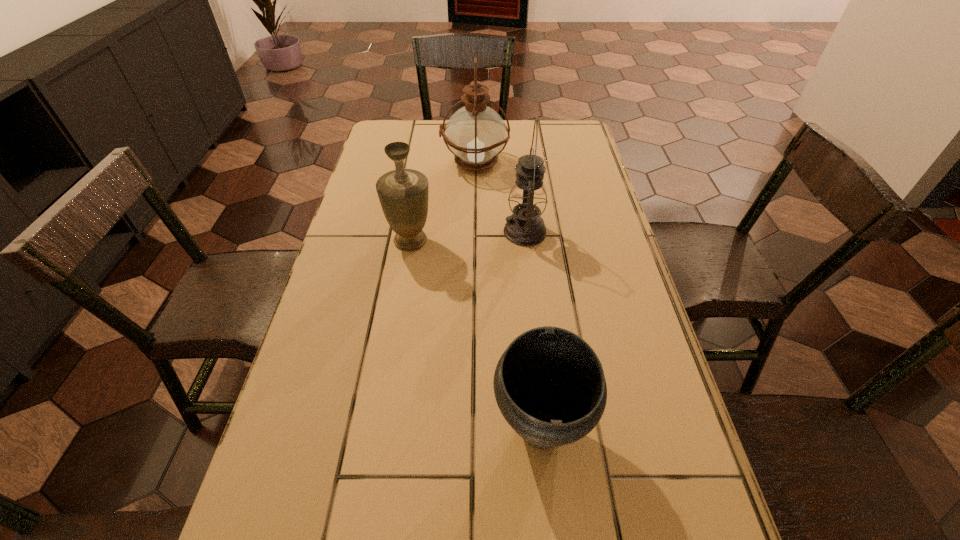
Identify the location of free space between the farther oil lamp and the third tallest object. (443, 202).

Identify the location of free space between the nearer oil lamp and the farthest object. (500, 197).

Identify which object is the third closest to the second shortest object. Please provide its 2D coordinates. Your answer should be formatted as a tuple, i.e. [(x, y)], where the tuple contains the x and y coordinates of a point satisfying the conditions above.

[(550, 374)]

Locate an element on the screen. object that can be found as the closest to the taller urn is located at coordinates (525, 227).